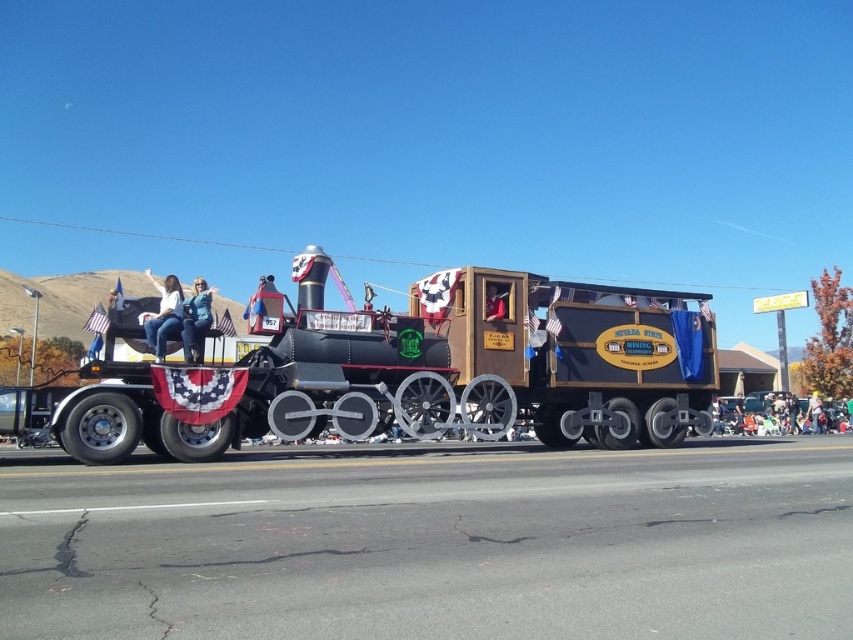
Does shiny black locomotive at center have a larger size compared to red fabric at center?

Indeed, shiny black locomotive at center has a larger size compared to red fabric at center.

Find the location of a particular element. shiny black locomotive at center is located at coordinates point(413,369).

Image resolution: width=853 pixels, height=640 pixels. What are the coordinates of `shiny black locomotive at center` in the screenshot? It's located at (413, 369).

Does red fabric at center lie behind light brown leather jacket at center?

No, it is in front of light brown leather jacket at center.

Can you confirm if red fabric at center is positioned to the right of light brown leather jacket at center?

No, red fabric at center is not to the right of light brown leather jacket at center.

Is point (497, 307) farther from viewer compared to point (816, 396)?

No, (497, 307) is in front of (816, 396).

This screenshot has height=640, width=853. I want to click on red fabric at center, so click(x=492, y=304).

Is white fabric pants at left smaller than light brown leather jacket at center?

Incorrect, white fabric pants at left is not smaller in size than light brown leather jacket at center.

Measure the distance between white fabric pants at left and light brown leather jacket at center.

The distance of white fabric pants at left from light brown leather jacket at center is 27.51 meters.

Is point (149, 328) positioned in front of point (819, 410)?

Yes, it is.

Where is `white fabric pants at left`? white fabric pants at left is located at coordinates (163, 316).